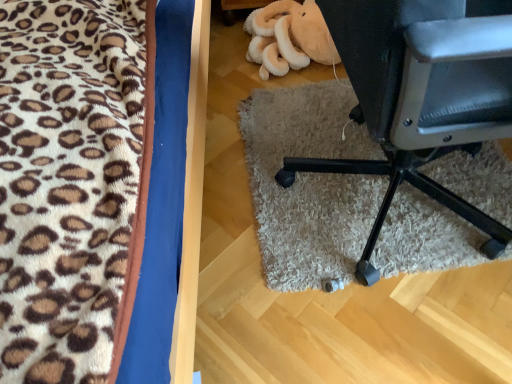
Question: Can you confirm if black leather chair at lower right is taller than fluffy leopard print blanket at left?

Choices:
 (A) yes
 (B) no

Answer: (B)

Question: Could fluffy leopard print blanket at left be considered to be inside black leather chair at lower right?

Choices:
 (A) yes
 (B) no

Answer: (B)

Question: From a real-world perspective, is black leather chair at lower right physically below fluffy leopard print blanket at left?

Choices:
 (A) no
 (B) yes

Answer: (B)

Question: Does black leather chair at lower right have a greater width compared to fluffy leopard print blanket at left?

Choices:
 (A) no
 (B) yes

Answer: (A)

Question: Are black leather chair at lower right and fluffy leopard print blanket at left making contact?

Choices:
 (A) yes
 (B) no

Answer: (B)

Question: From a real-world perspective, does black leather chair at lower right stand above fluffy leopard print blanket at left?

Choices:
 (A) yes
 (B) no

Answer: (B)

Question: Is soft plush toy at upper center completely or partially inside fluffy leopard print blanket at left?

Choices:
 (A) no
 (B) yes

Answer: (A)

Question: Considering the relative sizes of fluffy leopard print blanket at left and soft plush toy at upper center in the image provided, is fluffy leopard print blanket at left shorter than soft plush toy at upper center?

Choices:
 (A) yes
 (B) no

Answer: (B)

Question: Is the surface of fluffy leopard print blanket at left in direct contact with soft plush toy at upper center?

Choices:
 (A) no
 (B) yes

Answer: (A)

Question: Does fluffy leopard print blanket at left lie behind soft plush toy at upper center?

Choices:
 (A) yes
 (B) no

Answer: (B)

Question: Is fluffy leopard print blanket at left to the right of soft plush toy at upper center from the viewer's perspective?

Choices:
 (A) yes
 (B) no

Answer: (B)

Question: Does fluffy leopard print blanket at left have a lesser width compared to soft plush toy at upper center?

Choices:
 (A) yes
 (B) no

Answer: (B)

Question: Can you confirm if black leather chair at lower right is thinner than soft plush toy at upper center?

Choices:
 (A) yes
 (B) no

Answer: (B)